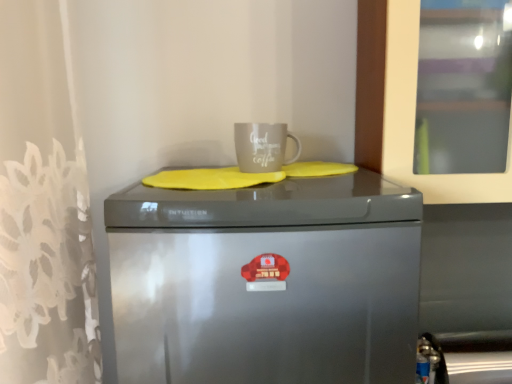
Question: From a real-world perspective, is satin silver fridge at center positioned above or below white glossy mug at upper center?

Choices:
 (A) below
 (B) above

Answer: (A)

Question: Considering their positions, is satin silver fridge at center located in front of or behind white glossy mug at upper center?

Choices:
 (A) front
 (B) behind

Answer: (A)

Question: Considering the positions of satin silver fridge at center and white glossy mug at upper center in the image, is satin silver fridge at center taller or shorter than white glossy mug at upper center?

Choices:
 (A) tall
 (B) short

Answer: (A)

Question: Is white glossy mug at upper center taller or shorter than satin silver fridge at center?

Choices:
 (A) tall
 (B) short

Answer: (B)

Question: Do you think white glossy mug at upper center is within satin silver fridge at center, or outside of it?

Choices:
 (A) outside
 (B) inside

Answer: (A)

Question: From a real-world perspective, is white glossy mug at upper center above or below satin silver fridge at center?

Choices:
 (A) below
 (B) above

Answer: (B)

Question: Considering their positions, is white glossy mug at upper center located in front of or behind satin silver fridge at center?

Choices:
 (A) behind
 (B) front

Answer: (A)